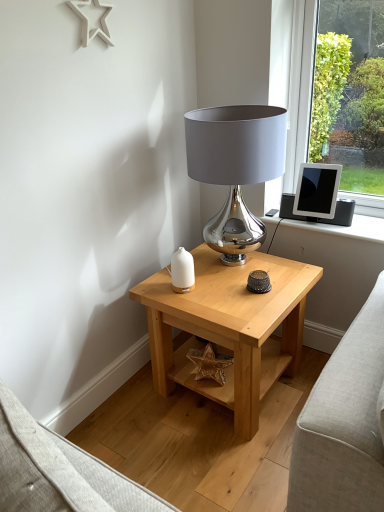
What are the coordinates of `vacant area on the back side of white glossy vase at center` in the screenshot? It's located at (193, 274).